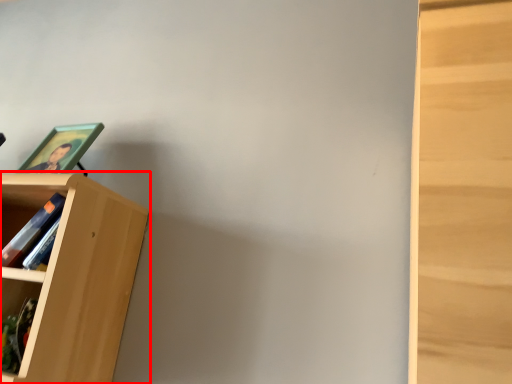
Question: Observing the image, what is the correct spatial positioning of bookcase (annotated by the red box) in reference to picture frame?

Choices:
 (A) right
 (B) left

Answer: (B)